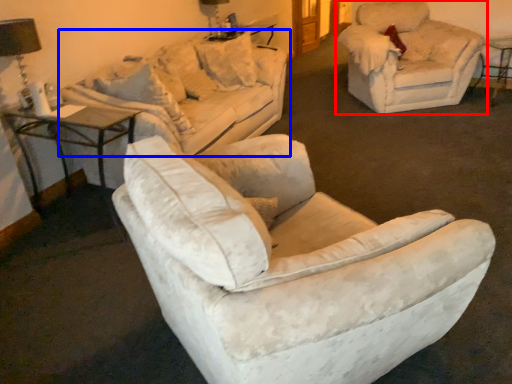
Question: Which object is closer to the camera taking this photo, chair (highlighted by a red box) or studio couch (highlighted by a blue box)?

Choices:
 (A) chair
 (B) studio couch

Answer: (B)